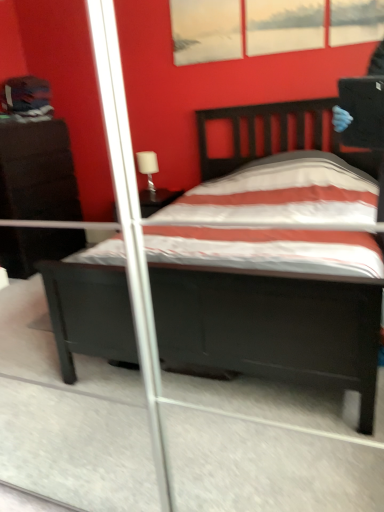
At what (x,y) coordinates should I click in order to perform the action: click on vacant space underneath matte black bed at center (from a real-world perspective). Please return your answer as a coordinate pair (x, y). Image resolution: width=384 pixels, height=512 pixels. Looking at the image, I should click on (174, 453).